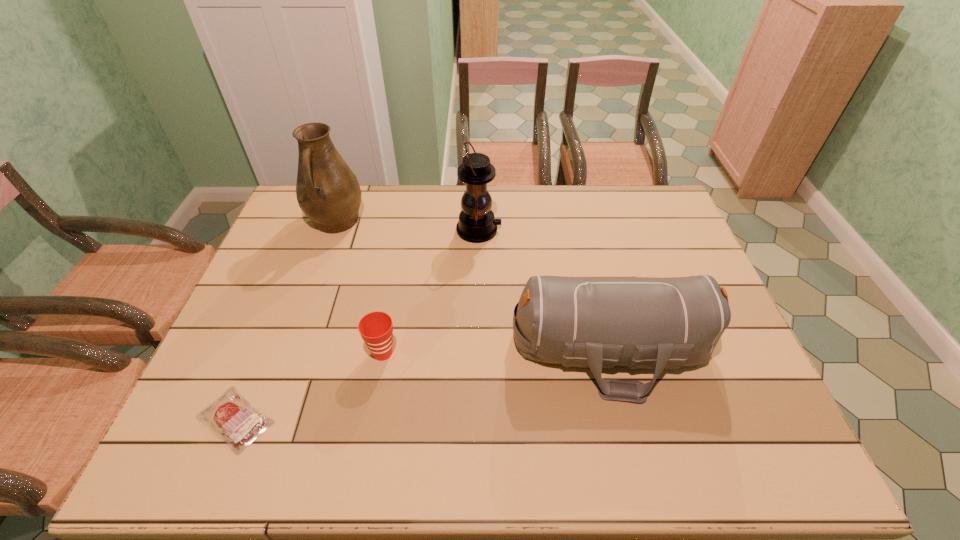
This screenshot has width=960, height=540. I want to click on vacant space that satisfies the following two spatial constraints: 1. above the rightmost object, indicating its light source; 2. on the right side of the lantern, so click(x=478, y=349).

Find the location of `vacant position in the image that satisfies the following two spatial constraints: 1. on the handle side of the rightmost object; 2. on the right side of the pitcher`. vacant position in the image that satisfies the following two spatial constraints: 1. on the handle side of the rightmost object; 2. on the right side of the pitcher is located at coordinates (291, 349).

Image resolution: width=960 pixels, height=540 pixels. I want to click on vacant space that satisfies the following two spatial constraints: 1. on the back side of the second shortest object; 2. on the left side of the steak, so (262, 353).

I want to click on vacant region that satisfies the following two spatial constraints: 1. on the back side of the steak; 2. on the left side of the third shortest object, so click(x=264, y=349).